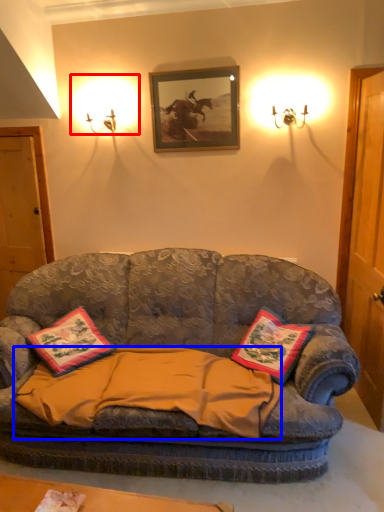
Question: Among these objects, which one is nearest to the camera, lighting (highlighted by a red box) or blanket (highlighted by a blue box)?

Choices:
 (A) lighting
 (B) blanket

Answer: (B)